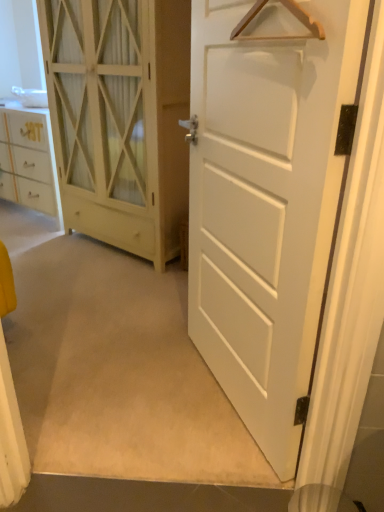
Locate an element on the screen. This screenshot has height=512, width=384. vacant space positioned to the left of white matte door at center, which appears as the 1th door when viewed from the front is located at coordinates (131, 387).